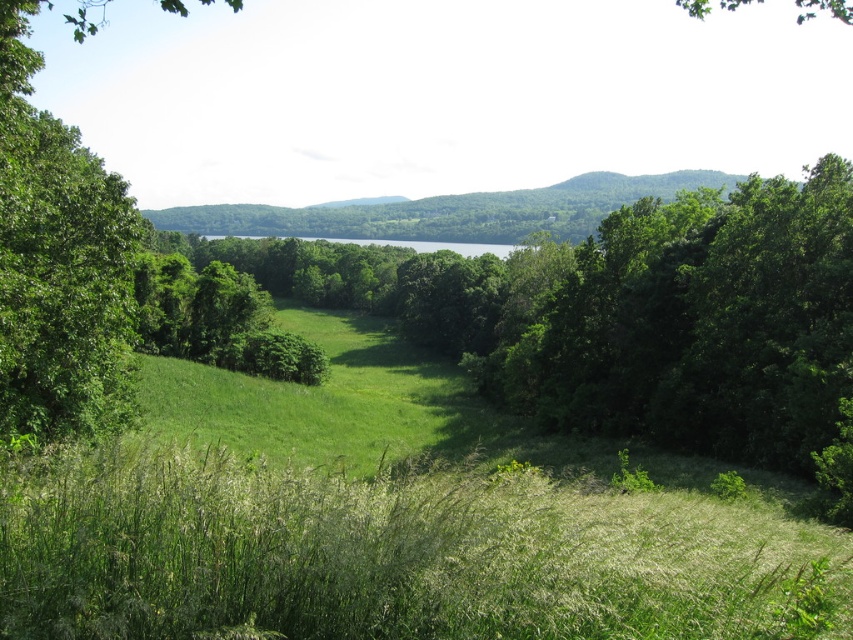
You are standing at the center of the image and want to walk towards the green grassy hillside at center. In which direction should you move?

The green grassy hillside at center is located at point coordinates of (448, 211). Since you are at the center of the image, you should move towards the direction of the coordinates to reach it.

You are standing in the serene natural landscape described. You see two points marked in the scene. Which point is closer to you, point (483, 209) or point (341, 243)?

Point (341, 243) is closer to you because it is less further to the camera than point (483, 209).

You are standing in the serene landscape and notice two green areas. The first is the green grassy hillside at center, and the second is the green grassy field at center. From your current position, which of these two areas is located to the right?

The green grassy hillside at center is to the right of the green grassy field at center, so the green grassy hillside at center is located to the right.